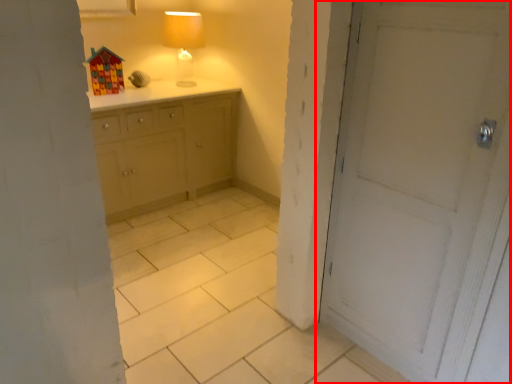
Question: From the image's perspective, where is door (annotated by the red box) located in relation to table lamp in the image?

Choices:
 (A) below
 (B) above

Answer: (A)